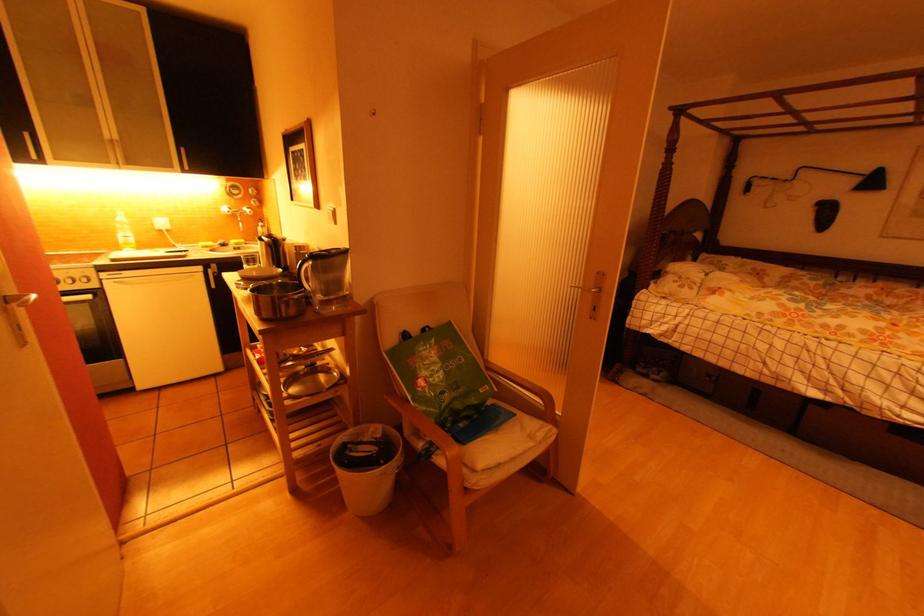
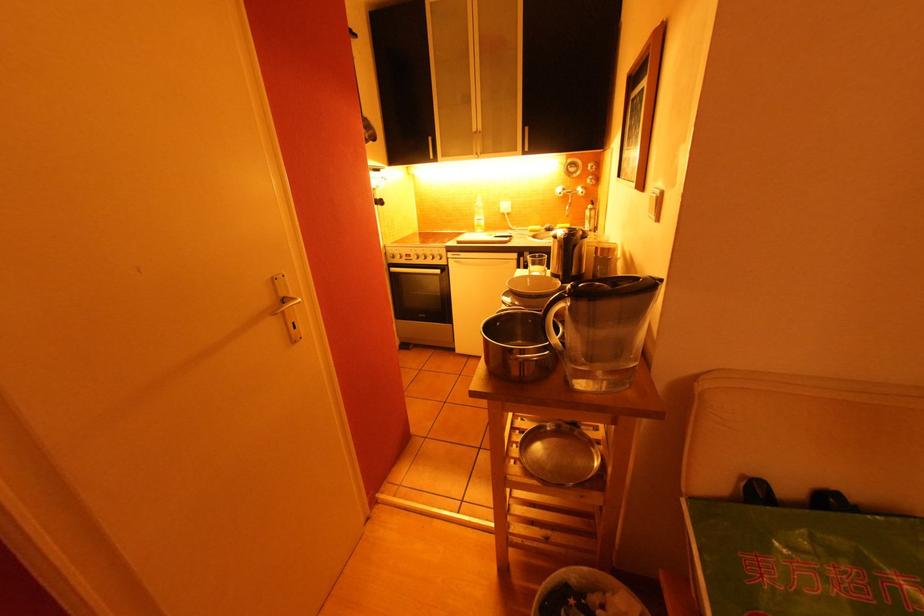
The point at [32,136] is marked in the first image. Where is the corresponding point in the second image?

(434, 140)